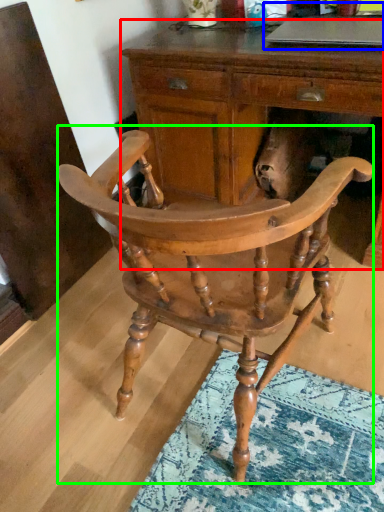
Question: Considering the real-world distances, which object is closest to desk (highlighted by a red box)? computer (highlighted by a blue box) or chair (highlighted by a green box).

Choices:
 (A) computer
 (B) chair

Answer: (A)